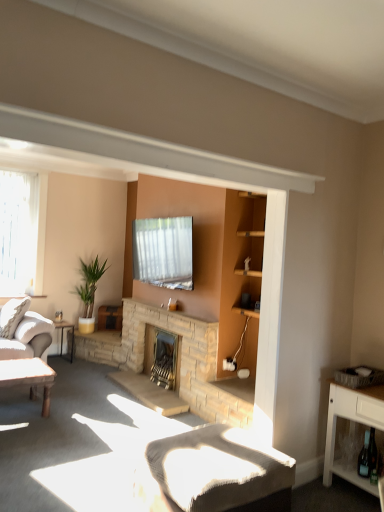
Describe the element at coordinates (29, 377) in the screenshot. The image size is (384, 512). I see `wooden table at lower left, which appears as the 2th table when viewed from the back` at that location.

In order to face white textured cushion at lower center, should I rotate leftwards or rightwards?

You should look right and rotate roughly 2.726 degrees.

At what (x,y) coordinates should I click in order to perform the action: click on metallic silver table at left, marked as the 1th table in a back-to-front arrangement. Please return your answer as a coordinate pair (x, y). Image resolution: width=384 pixels, height=512 pixels. Looking at the image, I should click on (62, 338).

In order to face metallic silver table at left, arranged as the second table when viewed from the front, should I rotate leftwards or rightwards?

To face it directly, rotate left by 17.812 degrees.

The image size is (384, 512). What do you see at coordinates (162, 357) in the screenshot? I see `stone fireplace at center, which is counted as the second fireplace, starting from the front` at bounding box center [162, 357].

Find the location of a particular element. The image size is (384, 512). stone fireplace at center, which is the first fireplace in back-to-front order is located at coordinates click(162, 357).

What do you see at coordinates (364, 458) in the screenshot?
I see `green glass wine bottle at lower right` at bounding box center [364, 458].

Find the location of a particular element. The height and width of the screenshot is (512, 384). wooden table at lower left, which appears as the 2th table when viewed from the back is located at coordinates (29, 377).

Which is behind, point (332, 442) or point (9, 371)?

The point (9, 371) is farther from the camera.

From the image's perspective, relative to wooden table at lower left, which appears as the 2th table when viewed from the back, is white wood cabinet at lower right above or below?

Based on their image positions, white wood cabinet at lower right is located beneath wooden table at lower left, which appears as the 2th table when viewed from the back.

From a real-world perspective, is white wood cabinet at lower right located higher than wooden table at lower left, the first table when ordered from front to back?

Yes.

Is point (361, 458) positioned after point (83, 291)?

No, it is not.

From a real-world perspective, does green glass wine bottle at lower right stand above green leafy plant in pot at left?

No, from a real-world perspective, green glass wine bottle at lower right is not on top of green leafy plant in pot at left.

Which object is further away from the camera taking this photo, green glass wine bottle at lower right or green leafy plant in pot at left?

green leafy plant in pot at left.

Identify the location of houseplant above the green glass wine bottle at lower right (from the image's perspective). (89, 285).

Is point (47, 412) closer or farther from the camera than point (201, 325)?

Point (47, 412).

Which fireplace is the 1st one when counting from the right side of the wooden table at lower left, the first table when ordered from front to back? Please provide its 2D coordinates.

[(181, 348)]

What's the angular difference between wooden table at lower left, the first table when ordered from front to back, and natural stone fireplace at center, the 1th fireplace viewed from the front,'s facing directions?

The angular difference between wooden table at lower left, the first table when ordered from front to back, and natural stone fireplace at center, the 1th fireplace viewed from the front, is 88.2 degrees.

Is wooden table at lower left, the first table when ordered from front to back, in front of natural stone fireplace at center, which is counted as the second fireplace, starting from the back?

Yes, wooden table at lower left, the first table when ordered from front to back, is closer to the camera.

Considering the positions of points (36, 178) and (49, 410), is point (36, 178) farther from camera compared to point (49, 410)?

Yes.

Are clear glass window at left and wooden table at lower left, which appears as the 2th table when viewed from the back, beside each other?

No, clear glass window at left is not making contact with wooden table at lower left, which appears as the 2th table when viewed from the back.

Could you tell me if clear glass window at left is turned towards wooden table at lower left, the first table when ordered from front to back?

Yes.

Who is smaller, clear glass window at left or wooden table at lower left, which appears as the 2th table when viewed from the back?

clear glass window at left is smaller.

From a real-world perspective, is wooden table at lower left, which appears as the 2th table when viewed from the back, physically located above or below green glass wine bottle at lower right?

Clearly, from a real-world perspective, wooden table at lower left, which appears as the 2th table when viewed from the back, is below green glass wine bottle at lower right.

Are wooden table at lower left, the first table when ordered from front to back, and green glass wine bottle at lower right located far from each other?

Yes, wooden table at lower left, the first table when ordered from front to back, and green glass wine bottle at lower right are located far from each other.

Consider the image. Considering the sizes of objects wooden table at lower left, which appears as the 2th table when viewed from the back, and green glass wine bottle at lower right in the image provided, who is taller, wooden table at lower left, which appears as the 2th table when viewed from the back, or green glass wine bottle at lower right?

wooden table at lower left, which appears as the 2th table when viewed from the back.

Which object is positioned more to the left, wooden table at lower left, which appears as the 2th table when viewed from the back, or green glass wine bottle at lower right?

wooden table at lower left, which appears as the 2th table when viewed from the back, is more to the left.

Is natural stone fireplace at center, the 1th fireplace viewed from the front, far away from green leafy plant in pot at left?

Yes, natural stone fireplace at center, the 1th fireplace viewed from the front, is far from green leafy plant in pot at left.

Which is behind, point (125, 337) or point (97, 272)?

Point (97, 272)

From a real-world perspective, is natural stone fireplace at center, the 1th fireplace viewed from the front, on top of green leafy plant in pot at left?

No, from a real-world perspective, natural stone fireplace at center, the 1th fireplace viewed from the front, is not over green leafy plant in pot at left

From their relative heights in the image, would you say natural stone fireplace at center, which is counted as the second fireplace, starting from the back, is taller or shorter than green leafy plant in pot at left?

Clearly, natural stone fireplace at center, which is counted as the second fireplace, starting from the back, is shorter compared to green leafy plant in pot at left.

Is metallic silver table at left, marked as the 1th table in a back-to-front arrangement, closer to the viewer compared to green leafy plant in pot at left?

Yes, it is in front of green leafy plant in pot at left.

Which of these two, metallic silver table at left, marked as the 1th table in a back-to-front arrangement, or green leafy plant in pot at left, stands taller?

With more height is green leafy plant in pot at left.

Does metallic silver table at left, arranged as the second table when viewed from the front, turn towards green leafy plant in pot at left?

No.

Looking at this image, from the image's perspective, is metallic silver table at left, arranged as the second table when viewed from the front, located above or below green leafy plant in pot at left?

Clearly, from the image's perspective, metallic silver table at left, arranged as the second table when viewed from the front, is below green leafy plant in pot at left.

Image resolution: width=384 pixels, height=512 pixels. I want to click on cabinetry below the wooden table at lower left, the first table when ordered from front to back (from the image's perspective), so click(x=351, y=420).

Find the location of a particular element. The image size is (384, 512). houseplant above the green glass wine bottle at lower right (from a real-world perspective) is located at coordinates (89, 285).

Looking at the image, which one is located closer to stone fireplace at center, which is counted as the second fireplace, starting from the front, natural stone fireplace at center, which is counted as the second fireplace, starting from the back, or wooden table at lower left, which appears as the 2th table when viewed from the back?

natural stone fireplace at center, which is counted as the second fireplace, starting from the back, is closer to stone fireplace at center, which is counted as the second fireplace, starting from the front.

Considering their positions, is natural stone fireplace at center, the 1th fireplace viewed from the front, positioned further to clear glass window at left than white textured cushion at lower center?

Among the two, white textured cushion at lower center is located further to clear glass window at left.

When comparing their distances from green leafy plant in pot at left, does natural stone fireplace at center, which is counted as the second fireplace, starting from the back, or green glass wine bottle at lower right seem further?

The object further to green leafy plant in pot at left is green glass wine bottle at lower right.

Estimate the real-world distances between objects in this image. Which object is further from clear glass window at left, white wood cabinet at lower right or wooden table at lower left, which appears as the 2th table when viewed from the back?

white wood cabinet at lower right.

Based on their spatial positions, is metallic silver table at left, arranged as the second table when viewed from the front, or stone fireplace at center, which is counted as the second fireplace, starting from the front, further from natural stone fireplace at center, which is counted as the second fireplace, starting from the back?

metallic silver table at left, arranged as the second table when viewed from the front, lies further to natural stone fireplace at center, which is counted as the second fireplace, starting from the back, than the other object.

Based on the photo, when comparing their distances from white textured cushion at lower center, does white wood cabinet at lower right or wooden table at lower left, the first table when ordered from front to back, seem further?

wooden table at lower left, the first table when ordered from front to back, is positioned further to the anchor white textured cushion at lower center.

Based on their spatial positions, is stone fireplace at center, which is the first fireplace in back-to-front order, or wooden table at lower left, which appears as the 2th table when viewed from the back, further from clear glass window at left?

stone fireplace at center, which is the first fireplace in back-to-front order, is further to clear glass window at left.

From the image, which object appears to be nearer to metallic silver table at left, arranged as the second table when viewed from the front, white textured cushion at lower center or stone fireplace at center, which is the first fireplace in back-to-front order?

The object closer to metallic silver table at left, arranged as the second table when viewed from the front, is stone fireplace at center, which is the first fireplace in back-to-front order.

Where is `fireplace between wooden table at lower left, the first table when ordered from front to back, and stone fireplace at center, which is the first fireplace in back-to-front order`? The height and width of the screenshot is (512, 384). fireplace between wooden table at lower left, the first table when ordered from front to back, and stone fireplace at center, which is the first fireplace in back-to-front order is located at coordinates (181, 348).

Locate an element on the screen. cabinetry between white textured cushion at lower center and green leafy plant in pot at left in the front-back direction is located at coordinates (351, 420).

This screenshot has width=384, height=512. I want to click on wine bottle between wooden table at lower left, the first table when ordered from front to back, and white wood cabinet at lower right, in the horizontal direction, so click(x=364, y=458).

I want to click on wine bottle between white textured cushion at lower center and green leafy plant in pot at left along the z-axis, so click(x=364, y=458).